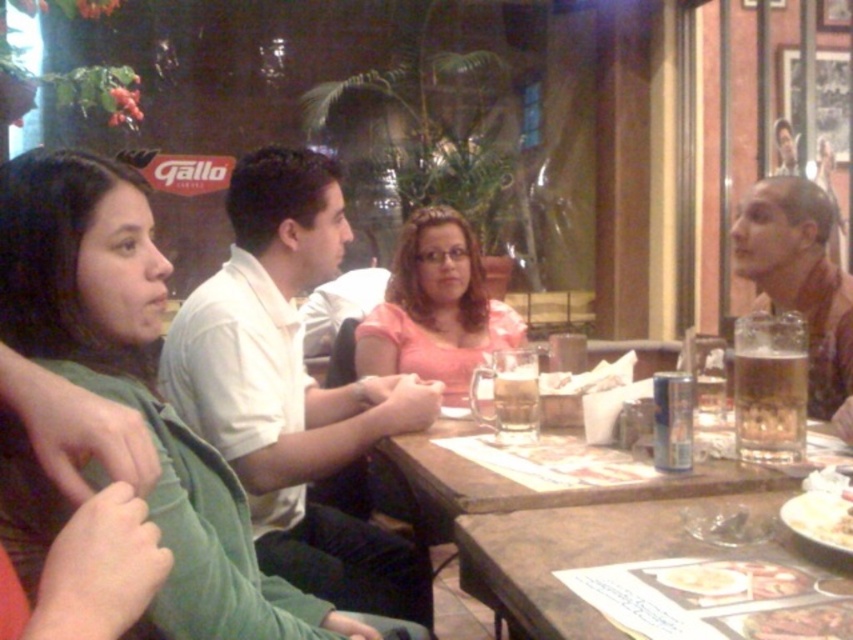
Which is more to the right, white cotton shirt at center or brown wooden table at center?

From the viewer's perspective, brown wooden table at center appears more on the right side.

Image resolution: width=853 pixels, height=640 pixels. Describe the element at coordinates (292, 388) in the screenshot. I see `white cotton shirt at center` at that location.

Image resolution: width=853 pixels, height=640 pixels. What do you see at coordinates (292, 388) in the screenshot? I see `white cotton shirt at center` at bounding box center [292, 388].

Where is `white cotton shirt at center`? Image resolution: width=853 pixels, height=640 pixels. white cotton shirt at center is located at coordinates (292, 388).

Measure the distance between point (389, 336) and camera.

Point (389, 336) and camera are 6.92 feet apart from each other.

Between point (479, 291) and point (521, 419), which one is positioned behind?

Positioned behind is point (479, 291).

Which is in front, point (405, 252) or point (498, 381)?

Positioned in front is point (498, 381).

Where is `pink fabric shirt at center`? The width and height of the screenshot is (853, 640). pink fabric shirt at center is located at coordinates (434, 308).

Is brown leather table at center smaller than white glossy plate at lower right?

Actually, brown leather table at center might be larger than white glossy plate at lower right.

Can you confirm if brown leather table at center is taller than white glossy plate at lower right?

Indeed, brown leather table at center has a greater height compared to white glossy plate at lower right.

Find the location of a particular element. brown leather table at center is located at coordinates (567, 556).